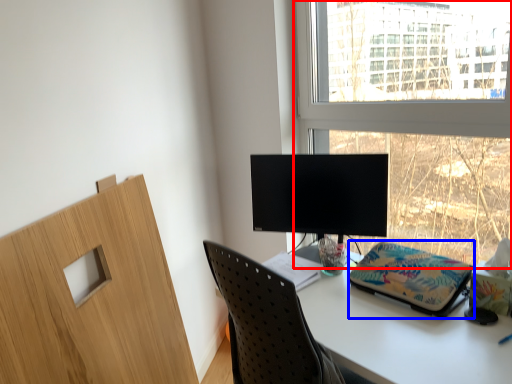
Question: Which of the following is the closest to the observer, window (highlighted by a red box) or stationery (highlighted by a blue box)?

Choices:
 (A) window
 (B) stationery

Answer: (A)